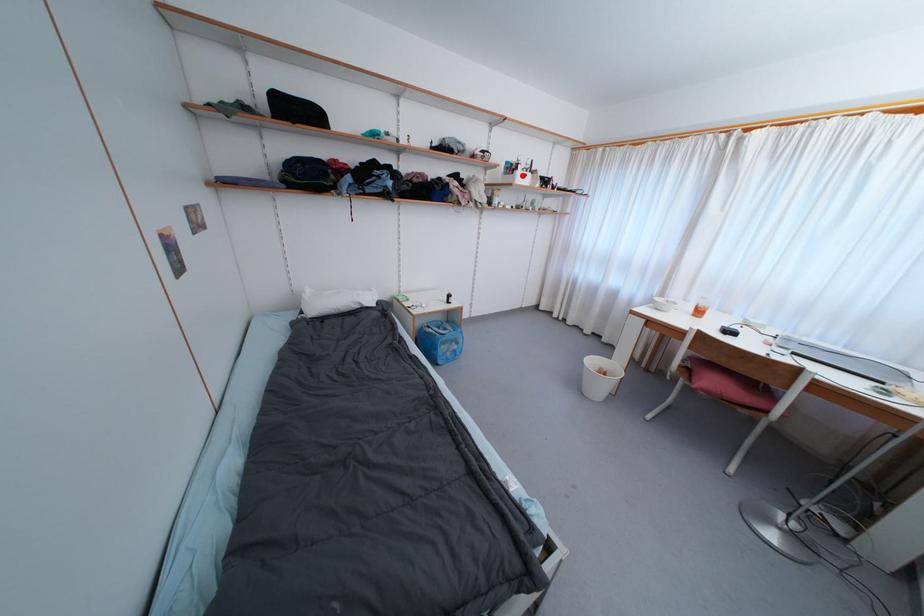
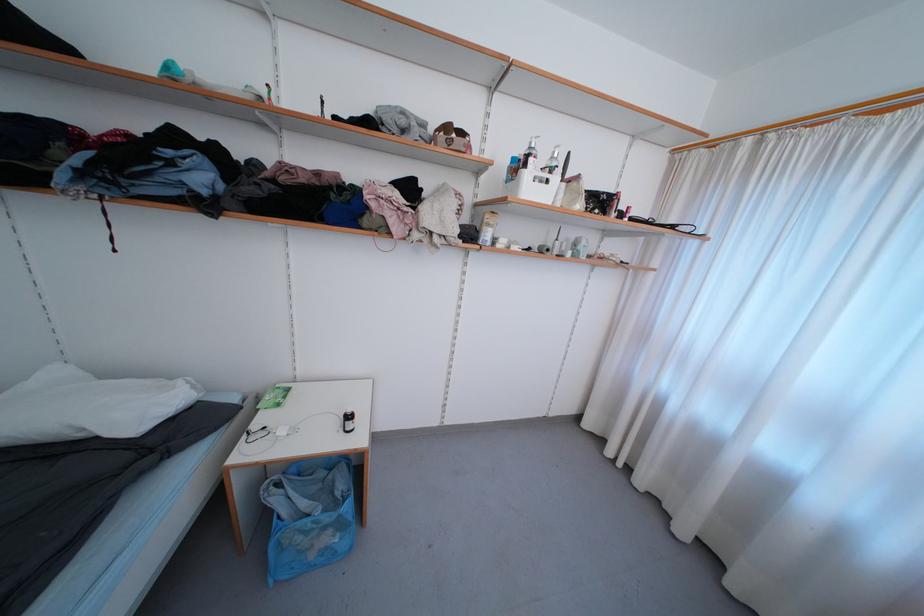
Question: I am providing you with two images of the same scene from different viewpoints. In image1, a red point is highlighted. Considering the same 3D point in image2, which of the following is correct?

Choices:
 (A) It is closer
 (B) It is farther

Answer: (B)